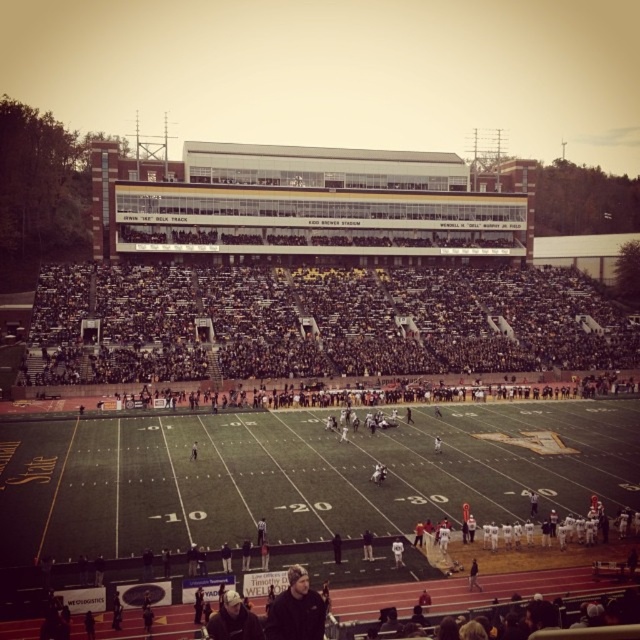
You are a photographer trying to capture a closeup shot of the black knit cap at lower center and the light brown leather jacket at center. Your camera has a limited focus range that can only accommodate objects up to 1 meter in width. Given their sizes, will both items fit within the camera frame?

The black knit cap at lower center is wider than the light brown leather jacket at center. However, since the camera can handle up to 1 meter, both items should fit as long as each is individually within the limit. But the description only states the black cap is wider than the jacket, not their exact sizes. Without knowing exact widths, we can only confirm the cap is larger than the jacket, but not if either exceeds 1m.

You are a photographer at the football stadium and want to capture a photo that includes both the black knit cap at lower center and the light brown leather jacket at center. Based on their positions, which object should appear lower in the photo?

The black knit cap at lower center should appear lower in the photo because it is located below the light brown leather jacket at center.

You are sitting in the black knit cap at lower center and want to move to the black plastic seats at center. Can you walk directly upwards from your current position to reach them?

The black plastic seats at center are located above the black knit cap at lower center, so yes, you can walk directly upwards from your current position to reach them.